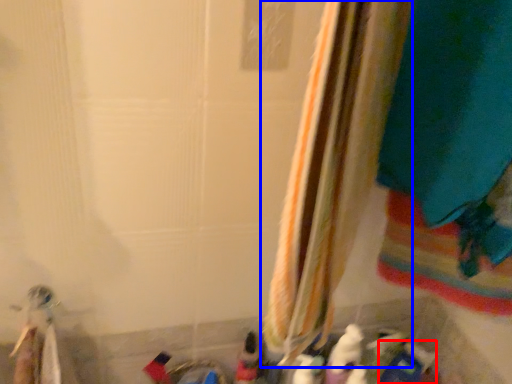
Question: Which of the following is the closest to the observer, toy (highlighted by a red box) or curtain (highlighted by a blue box)?

Choices:
 (A) toy
 (B) curtain

Answer: (B)